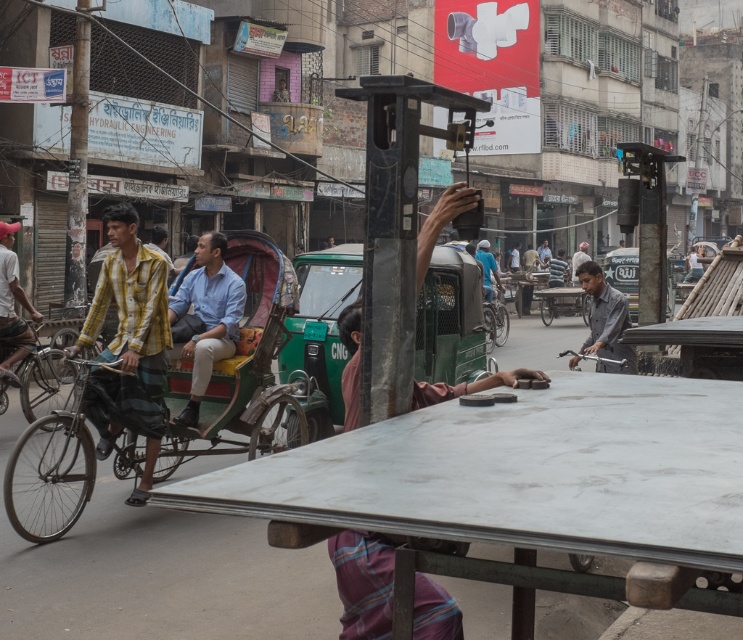
Can you confirm if yellow plaid shirt at left is positioned above dark gray metallic phone at center?

Indeed, yellow plaid shirt at left is positioned over dark gray metallic phone at center.

Between point (146, 349) and point (340, 317), which one is positioned in front?

Point (340, 317)

Is point (149, 276) in front of point (429, 595)?

No, (149, 276) is behind (429, 595).

Where is `yellow plaid shirt at left`? The width and height of the screenshot is (743, 640). yellow plaid shirt at left is located at coordinates (129, 344).

Does green painted wood cart at left have a lesser width compared to gray matte shirt at center?

In fact, green painted wood cart at left might be wider than gray matte shirt at center.

Who is more distant from viewer, (56, 440) or (577, 272)?

Positioned behind is point (577, 272).

Is point (74, 404) less distant than point (588, 337)?

That is True.

Where is `green painted wood cart at left`? The height and width of the screenshot is (640, 743). green painted wood cart at left is located at coordinates (246, 369).

Which is above, green painted wood cart at left or light blue shirt at center?

light blue shirt at center is higher up.

Who is lower down, green painted wood cart at left or light blue shirt at center?

green painted wood cart at left is lower down.

Does point (259, 310) lie in front of point (212, 342)?

No, it is not.

In order to click on green painted wood cart at left in this screenshot , I will do `click(246, 369)`.